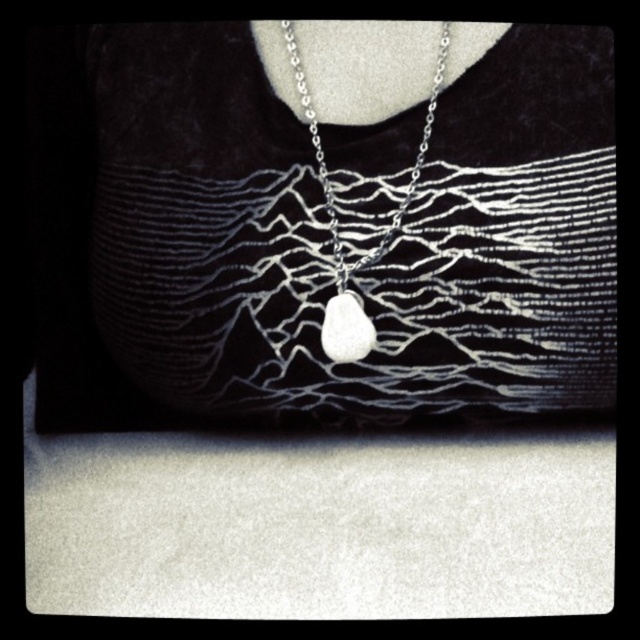
You are an appraiser examining the necklace displayed on the mannequin. The appraiser needs to ensure the necklace is centered precisely for the evaluation. According to the image, is the silver metallic necklace at center positioned exactly at the center coordinates of the image?

The silver metallic necklace at center is located at point (x=356, y=214), which does not match the exact center coordinates of the image, so it is not perfectly centered.

You are a jewelry designer examining the necklace displayed on the mannequin. You need to determine the placement of the pendant relative to the chain. Is the white matte stone at center positioned above or below the silver metallic necklace at center?

The silver metallic necklace at center is above the white matte stone at center, meaning the pendant is below the chain.

You are a jewelry designer examining the necklace displayed on the mannequin. You need to determine the vertical arrangement of the silver metallic pendant at center and the white matte stone at center. Which one is positioned higher?

The silver metallic pendant at center is positioned higher than the white matte stone at center.